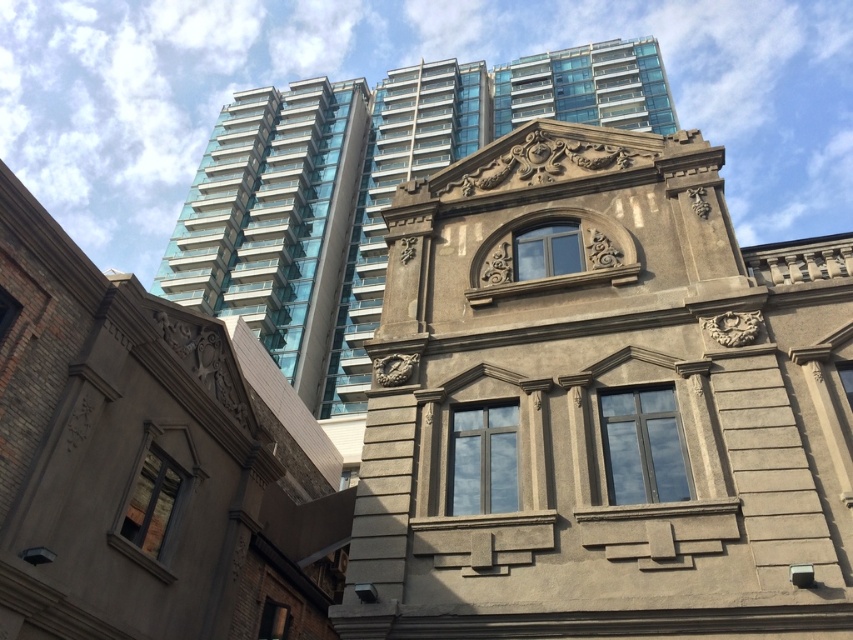
Does smooth concrete building at center have a greater height compared to glassy blue skyscraper at upper center?

In fact, smooth concrete building at center may be shorter than glassy blue skyscraper at upper center.

This screenshot has height=640, width=853. I want to click on smooth concrete building at center, so click(x=602, y=404).

Where is `smooth concrete building at center`? The image size is (853, 640). smooth concrete building at center is located at coordinates (602, 404).

Is smooth concrete building at center above gold textured clock at center?

Yes.

Is smooth concrete building at center smaller than gold textured clock at center?

Actually, smooth concrete building at center might be larger than gold textured clock at center.

Which is behind, point (711, 403) or point (381, 381)?

Point (381, 381)

Find the location of `smooth concrete building at center`. smooth concrete building at center is located at coordinates (602, 404).

Who is shorter, glassy blue skyscraper at upper center or gold textured clock at center?

gold textured clock at center is shorter.

Is point (631, 102) positioned before point (389, 374)?

No, it is not.

Where is `glassy blue skyscraper at upper center`? The width and height of the screenshot is (853, 640). glassy blue skyscraper at upper center is located at coordinates (363, 189).